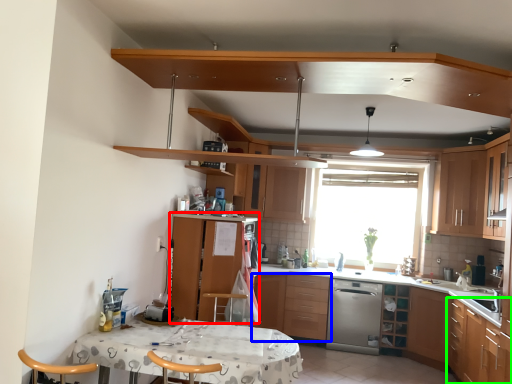
Question: Based on their relative distances, which object is farther from cabinetry (highlighted by a red box)? Choose from cabinetry (highlighted by a blue box) and cabinetry (highlighted by a green box).

Choices:
 (A) cabinetry
 (B) cabinetry

Answer: (B)